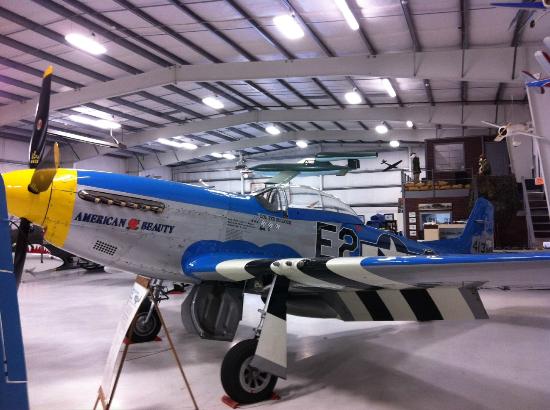
Find the location of a particular element. The width and height of the screenshot is (550, 410). blue paint is located at coordinates (185, 202), (207, 262), (463, 240), (463, 259).